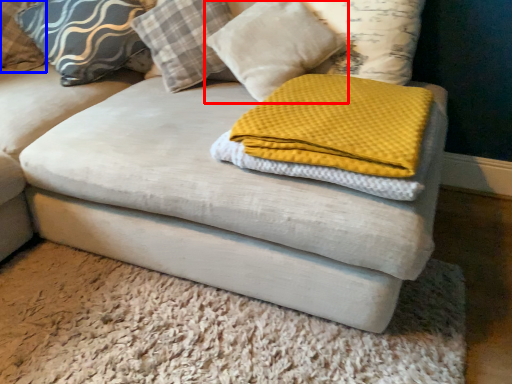
Question: Which of the following is the farthest to the observer, pillow (highlighted by a red box) or pillow (highlighted by a blue box)?

Choices:
 (A) pillow
 (B) pillow

Answer: (B)